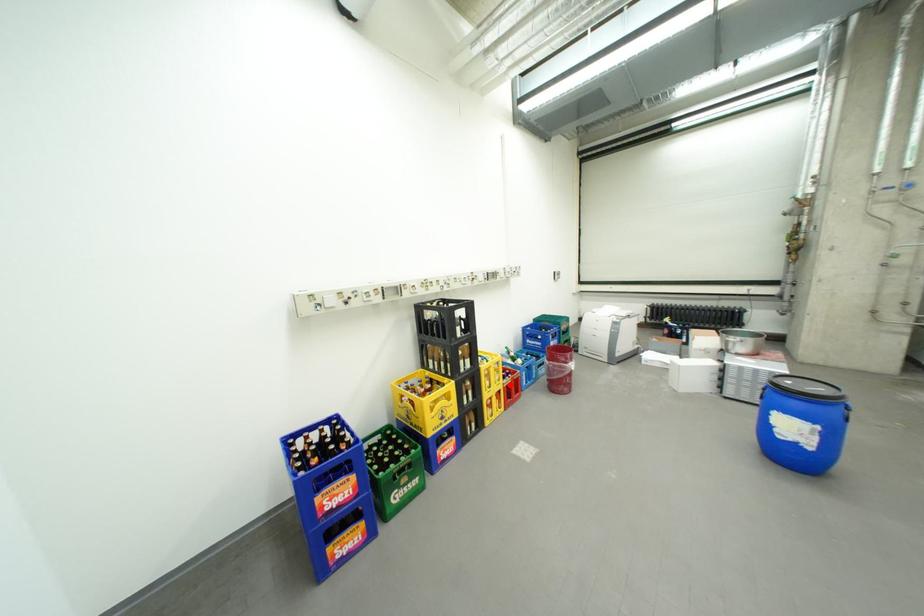
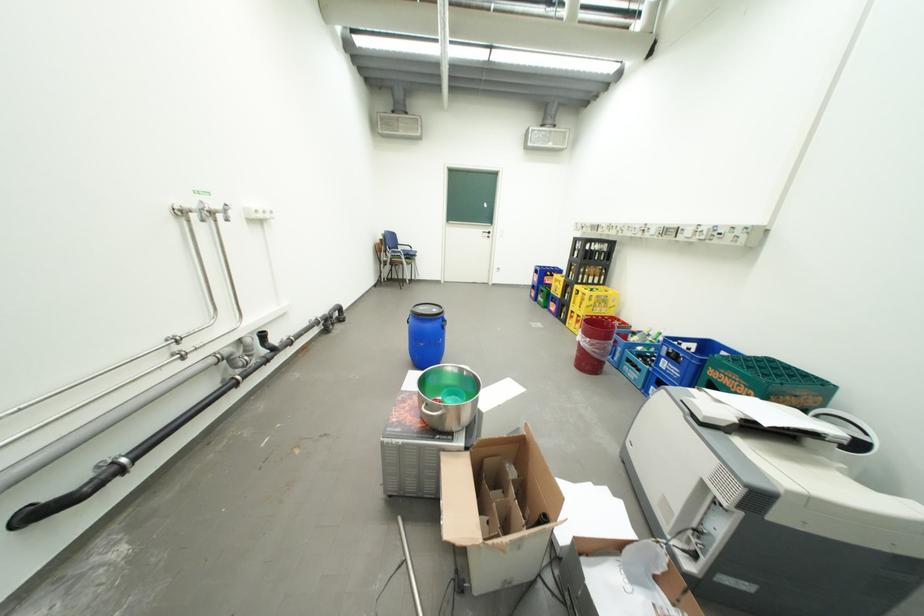
Question: A red point is marked in image1. In image2, is the corresponding 3D point closer to the camera or farther? Reply with the corresponding letter.

Choices:
 (A) The corresponding 3D point is closer.
 (B) The corresponding 3D point is farther.

Answer: (A)